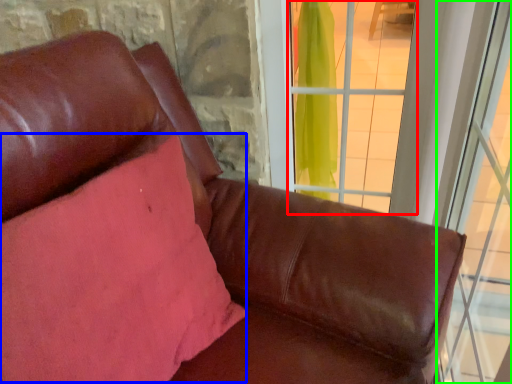
Question: Which object is the farthest from window (highlighted by a red box)? Choose among these: pillow (highlighted by a blue box) or window (highlighted by a green box).

Choices:
 (A) pillow
 (B) window

Answer: (A)